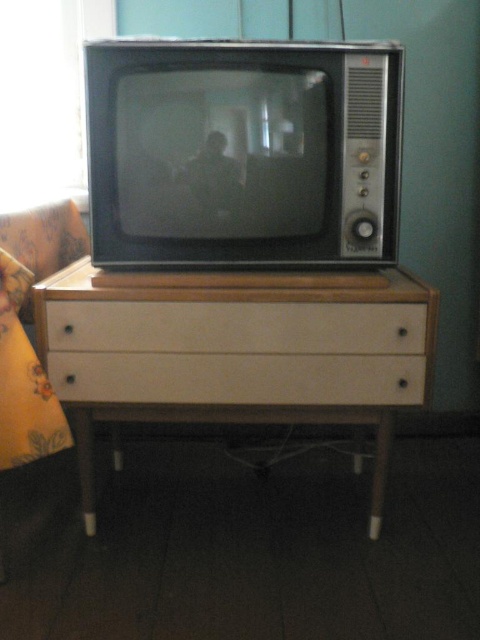
You are organizing a living room and need to place a large decorative vase. You have a white wood table at center and a white matte drawer at center. Which surface can accommodate the vase better?

The white wood table at center is bigger than the white matte drawer at center, so it can accommodate the vase better.

You are moving a small potted plant and want to place it on the white wood table at center. However, there is a beige matte drawer at center above it. Will the plant fit on the table without being blocked by the drawer?

The white wood table at center is positioned under the beige matte drawer at center, so placing the plant on the table would be possible as the drawer is above it and not obstructing the surface.

You are organizing a living room and need to decide which drawer to place a tall lamp on. The beige matte drawer at center and the white matte drawer at center are both options. Which drawer should you choose to ensure the lamp doesn not tip over?

The white matte drawer at center is taller than the beige matte drawer at center, so placing the tall lamp on the white matte drawer at center would provide a more stable base and prevent tipping.